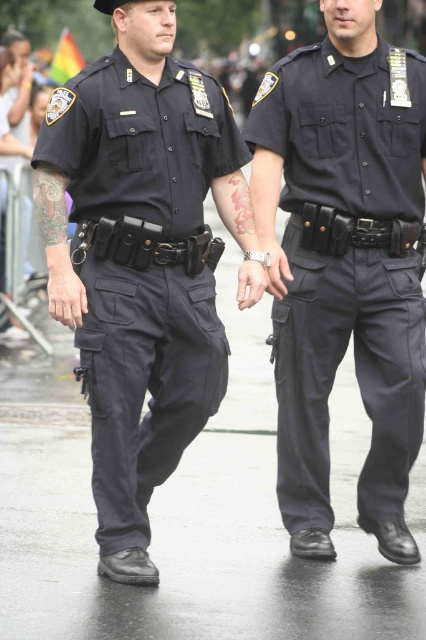
Is matte black uniform at center wider than matte black uniform at left?

In fact, matte black uniform at center might be narrower than matte black uniform at left.

Looking at this image, can you confirm if matte black uniform at center is shorter than matte black uniform at left?

In fact, matte black uniform at center may be taller than matte black uniform at left.

This screenshot has height=640, width=426. Find the location of `matte black uniform at center`. matte black uniform at center is located at coordinates (345, 269).